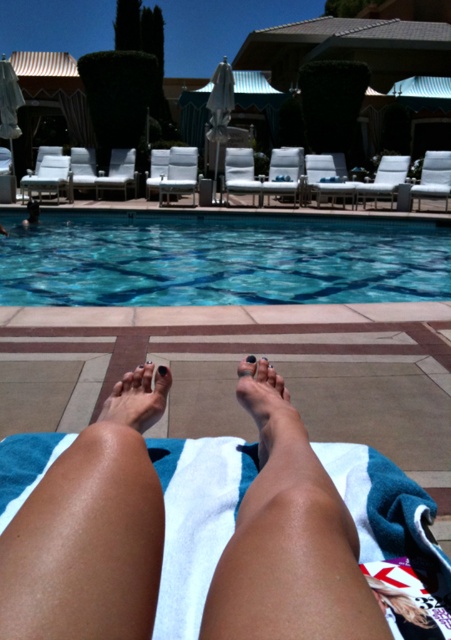
Which is more to the left, nail polish painted toenail at center or matte black toe at center?

From the viewer's perspective, nail polish painted toenail at center appears more on the left side.

Between nail polish painted toenail at center and matte black toe at center, which one has more height?

Standing taller between the two is nail polish painted toenail at center.

Locate an element on the screen. Image resolution: width=451 pixels, height=640 pixels. nail polish painted toenail at center is located at coordinates (137, 397).

Measure the distance between point [44,227] and camera.

The distance of point [44,227] from camera is 9.56 meters.

In the scene shown: Does blue glassy water at center have a larger size compared to black nail polish at center?

Correct, blue glassy water at center is larger in size than black nail polish at center.

Is point (357, 230) more distant than point (165, 376)?

Yes, it is behind point (165, 376).

Find the location of a particular element. This screenshot has width=451, height=640. blue glassy water at center is located at coordinates (220, 259).

In the scene shown: Can you confirm if nail polish matte foot at lower center is positioned to the left of black nail polish at center?

Incorrect, nail polish matte foot at lower center is not on the left side of black nail polish at center.

Who is shorter, nail polish matte foot at lower center or black nail polish at center?

Standing shorter between the two is black nail polish at center.

Is point (240, 390) farther from camera compared to point (162, 372)?

No, (240, 390) is in front of (162, 372).

This screenshot has height=640, width=451. I want to click on nail polish matte foot at lower center, so click(x=272, y=417).